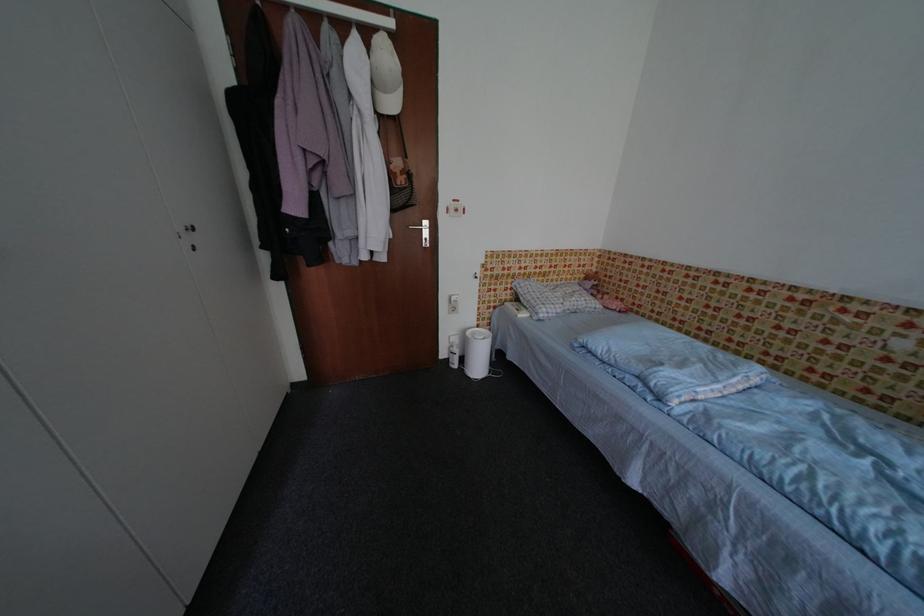
I want to click on cabinet knob, so click(188, 228).